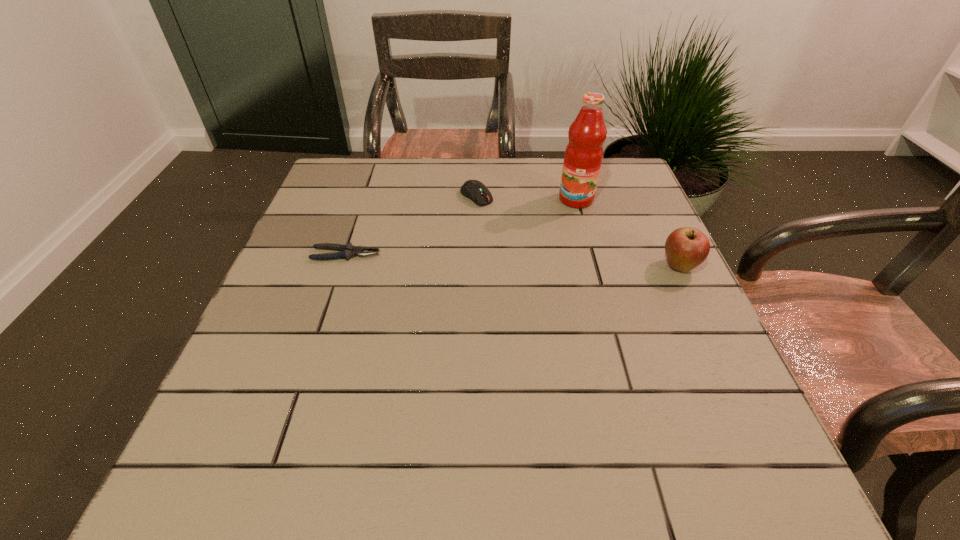
Find the location of a particular element. the shortest object is located at coordinates (347, 251).

Where is `pliers`? This screenshot has height=540, width=960. pliers is located at coordinates (347, 251).

Locate an element on the screen. The image size is (960, 540). apple is located at coordinates 686,248.

Locate an element on the screen. the rightmost object is located at coordinates (686, 248).

Locate an element on the screen. Image resolution: width=960 pixels, height=540 pixels. computer equipment is located at coordinates (475, 190).

Locate an element on the screen. the second shortest object is located at coordinates (475, 190).

Image resolution: width=960 pixels, height=540 pixels. What are the coordinates of `the tallest object` in the screenshot? It's located at (x=583, y=156).

Identify the location of the third object from left to right. (583, 156).

Find the location of a particular element. vacant space located at the gripping part of the shortest object is located at coordinates (479, 254).

The height and width of the screenshot is (540, 960). I want to click on free location located on the front of the second tallest object, so click(705, 319).